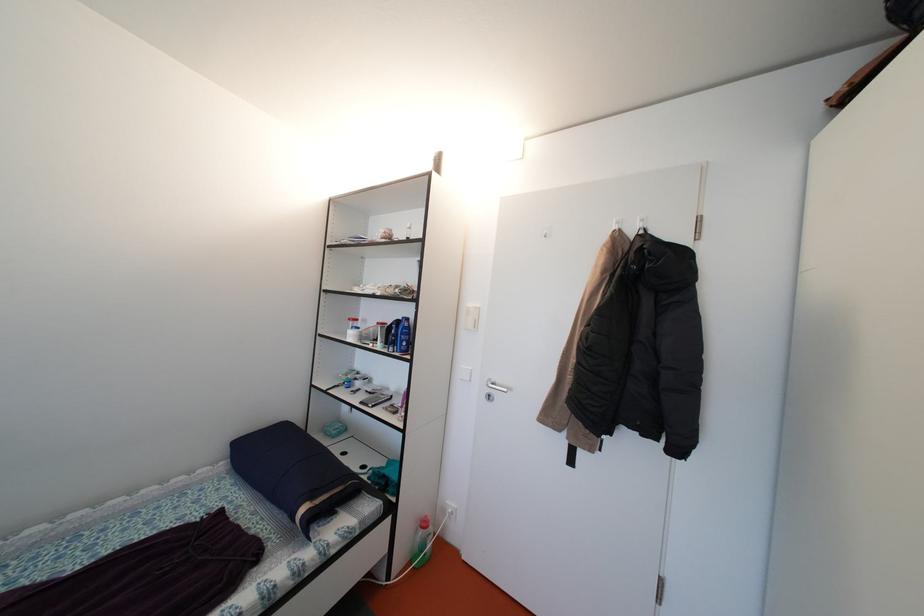
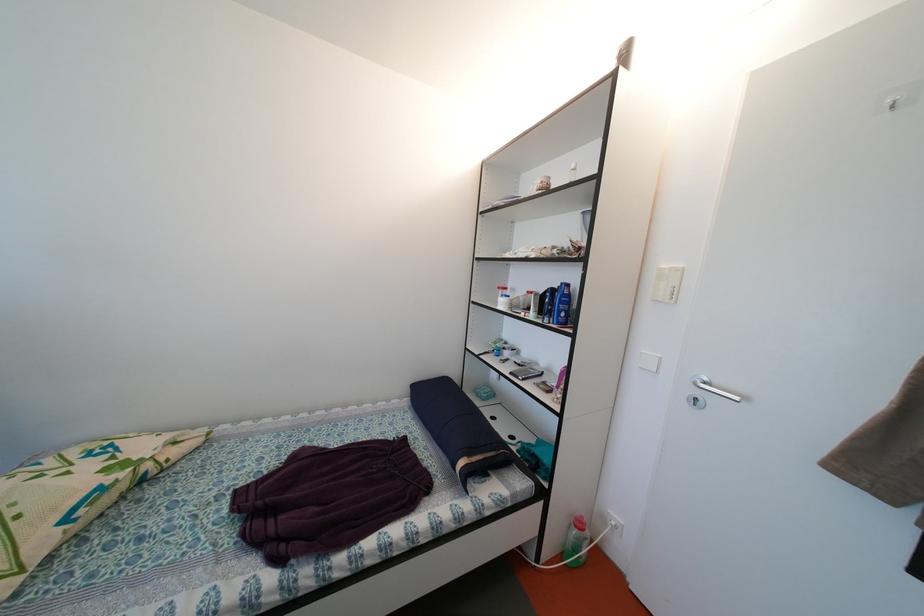
Question: The camera is either moving clockwise (left) or counter-clockwise (right) around the object. The first image is from the beginning of the video and the second image is from the end. Is the camera moving left or right when shooting the video?

Choices:
 (A) Left
 (B) Right

Answer: (B)